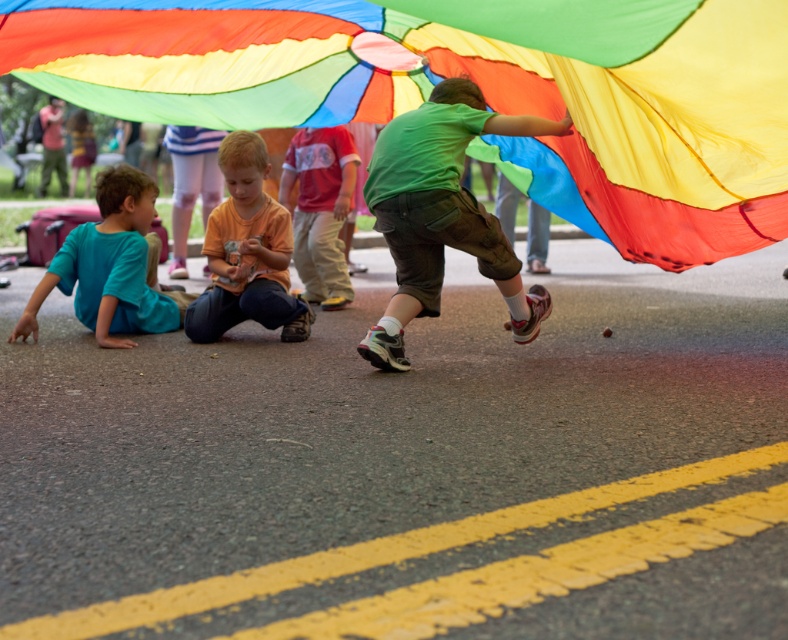
Based on the photo, does rainbow fabric parachute at upper center have a lesser height compared to matte blue shirt at lower left?

No.

What do you see at coordinates (480, 88) in the screenshot? Image resolution: width=788 pixels, height=640 pixels. I see `rainbow fabric parachute at upper center` at bounding box center [480, 88].

Where is `rainbow fabric parachute at upper center`? This screenshot has height=640, width=788. rainbow fabric parachute at upper center is located at coordinates (480, 88).

Who is more forward, [662,243] or [277,243]?

Point [662,243] is in front.

In the scene shown: Which is more to the left, rainbow fabric parachute at upper center or orange cotton shirt at center?

Positioned to the left is orange cotton shirt at center.

The height and width of the screenshot is (640, 788). What do you see at coordinates (480, 88) in the screenshot?
I see `rainbow fabric parachute at upper center` at bounding box center [480, 88].

You are a GUI agent. You are given a task and a screenshot of the screen. Output one action in this format:
    pyautogui.click(x=<x>, y=<y>)
    Task: Click on the rainbow fabric parachute at upper center
    
    Given the screenshot: What is the action you would take?
    pyautogui.click(x=480, y=88)

Between rainbow fabric parachute at upper center and green matte shorts at center, which one appears on the right side from the viewer's perspective?

green matte shorts at center

Is point (212, 74) positioned behind point (526, 326)?

Yes, point (212, 74) is farther from viewer.

Where is `rainbow fabric parachute at upper center`? rainbow fabric parachute at upper center is located at coordinates (480, 88).